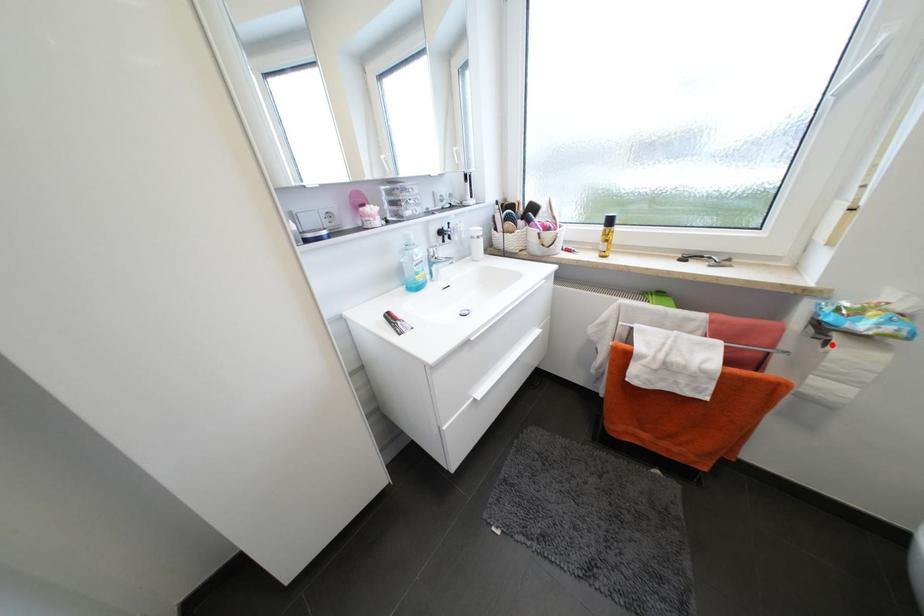
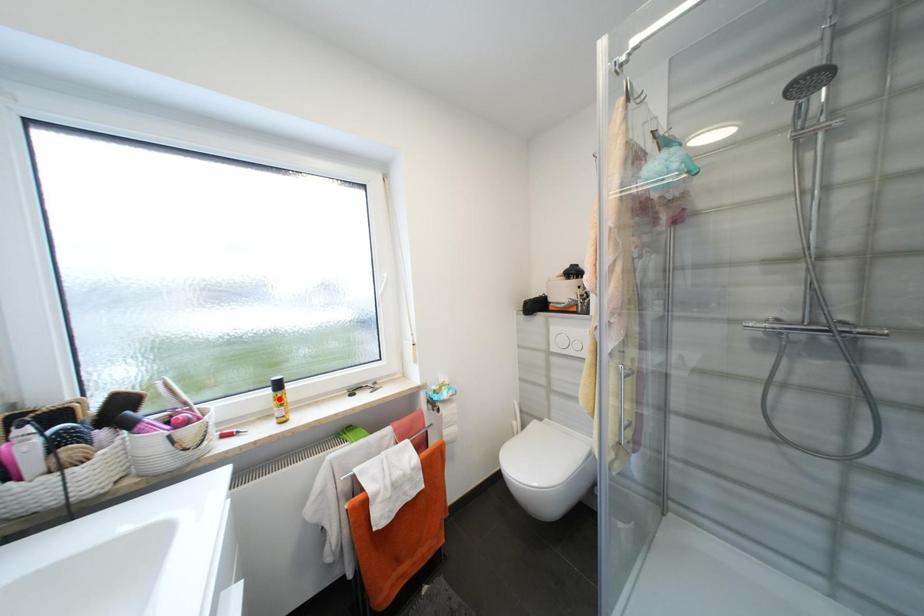
I am providing you with two images of the same scene from different viewpoints. A red point is marked on the first image and another point is marked on the second image. Is the marked point in image1 the same physical position as the marked point in image2?

No